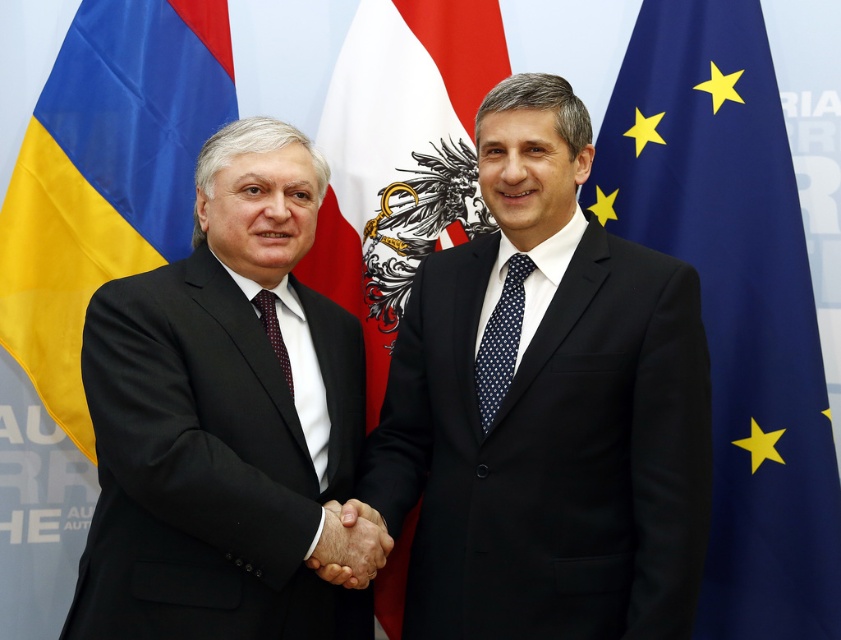
Question: Which is farther from the blue fabric flag at left?

Choices:
 (A) dark blue suit at center
 (B) navy dotted tie at center
 (C) smooth skin handshake at center
 (D) blue fabric flag at right

Answer: (D)

Question: Is dark blue suit at center further to the viewer compared to matte black suit at left?

Choices:
 (A) yes
 (B) no

Answer: (A)

Question: Is white fabric flag at center behind smooth skin handshake at center?

Choices:
 (A) yes
 (B) no

Answer: (A)

Question: Which object is farther from the camera taking this photo?

Choices:
 (A) smooth skin handshake at center
 (B) white fabric flag at center
 (C) dark red textured tie at center
 (D) dark blue suit at center

Answer: (B)

Question: Which object is positioned farthest from the white fabric flag at center?

Choices:
 (A) navy dotted tie at center
 (B) smooth skin handshake at center
 (C) dark red textured tie at center
 (D) dark blue suit at center

Answer: (B)

Question: In this image, where is blue fabric flag at right located relative to white fabric flag at center?

Choices:
 (A) above
 (B) below

Answer: (B)